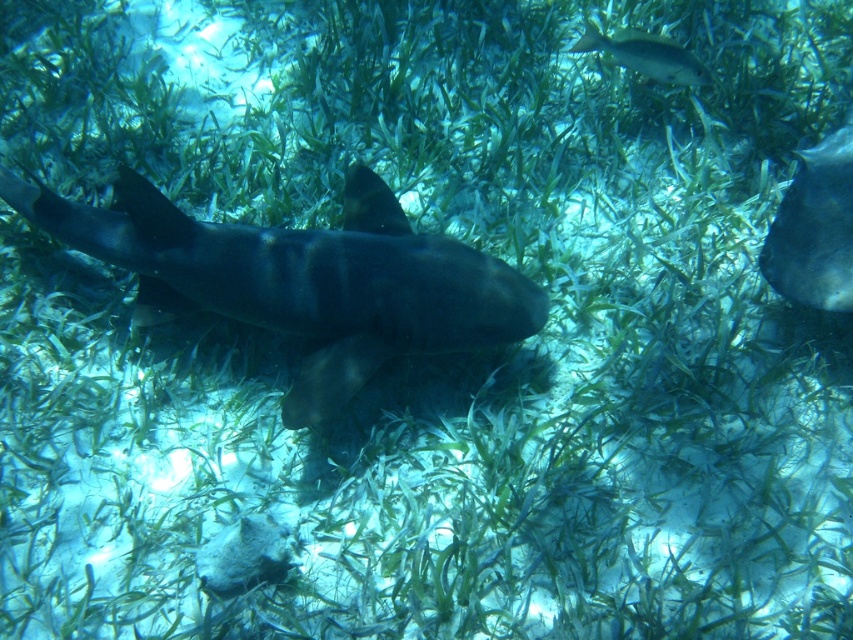
You are a scuba diver observing the underwater scene. You see the dark gray matte shark at center and the shiny silver fish at upper right. Which object is closer to you from your diving position?

The dark gray matte shark at center is closer to you because it is positioned in front of the shiny silver fish at upper right.

You are a marine biologist observing the underwater scene. You need to determine if the dark gray matte shark at center can reach the shiny silver fish at upper right within a single swimming motion. The shark requires at least 0.9 meters of space to maneuver. Can it reach the fish?

The dark gray matte shark at center is 1.08 meters away from the shiny silver fish at upper right. Since the shark requires at least 0.9 meters of space to maneuver, it can reach the fish as the distance is sufficient.